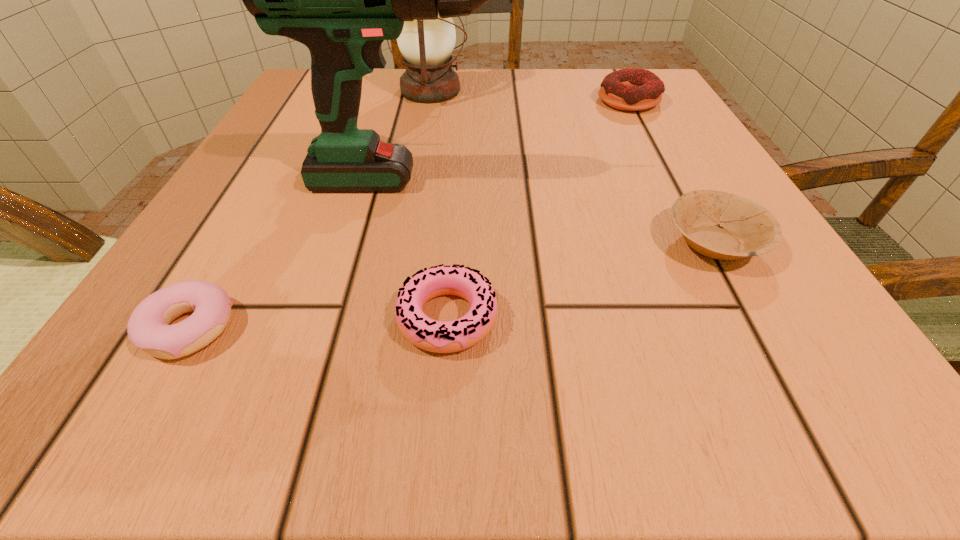
Locate an element on the screen. This screenshot has height=540, width=960. object that is at the far right corner is located at coordinates (629, 89).

What are the coordinates of `vacant space at the near edge of the desktop` in the screenshot? It's located at (696, 415).

Find the location of a particular element. The width and height of the screenshot is (960, 540). free space at the right edge of the desktop is located at coordinates (670, 224).

Find the location of a particular element. vacant region at the far right corner of the desktop is located at coordinates pyautogui.click(x=627, y=119).

In order to click on free space at the near right corner of the desktop in this screenshot , I will do `click(812, 365)`.

At what (x,y) coordinates should I click in order to perform the action: click on free space between the oil lamp and the farthest doughnut. Please return your answer as a coordinate pair (x, y). The height and width of the screenshot is (540, 960). Looking at the image, I should click on (530, 96).

Find the location of a particular element. The height and width of the screenshot is (540, 960). free spot between the fourth shortest object and the bowl is located at coordinates (671, 172).

Find the location of a particular element. free space between the bowl and the oil lamp is located at coordinates (572, 166).

The image size is (960, 540). I want to click on free space between the oil lamp and the fourth shortest object, so click(530, 96).

Find the location of `free point between the second doughnut from right to left and the bowl`. free point between the second doughnut from right to left and the bowl is located at coordinates (581, 280).